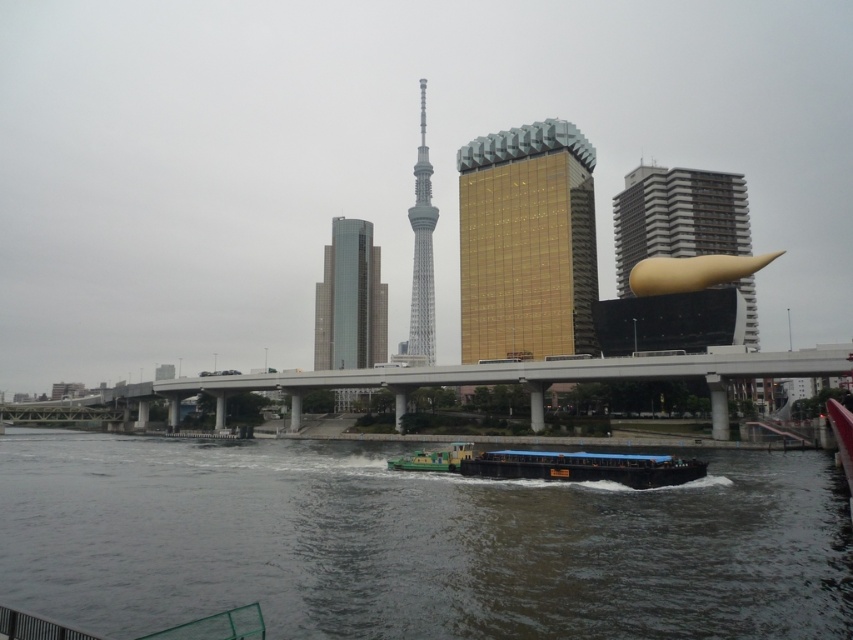
Is point (531, 481) farther from camera compared to point (556, 188)?

That is False.

Can you confirm if dark gray water at center is bigger than gold glass building at center?

No, dark gray water at center is not bigger than gold glass building at center.

Locate an element on the screen. The width and height of the screenshot is (853, 640). dark gray water at center is located at coordinates (415, 545).

I want to click on dark gray water at center, so click(x=415, y=545).

Is glassy gray skyscraper at center to the right of dark blue wooden barge at center from the viewer's perspective?

No, glassy gray skyscraper at center is not to the right of dark blue wooden barge at center.

From the picture: Is glassy gray skyscraper at center thinner than dark blue wooden barge at center?

No.

This screenshot has width=853, height=640. What do you see at coordinates (350, 300) in the screenshot?
I see `glassy gray skyscraper at center` at bounding box center [350, 300].

Image resolution: width=853 pixels, height=640 pixels. Identify the location of glassy gray skyscraper at center. (350, 300).

From the picture: Can you confirm if gold glass building at center is taller than green matte barge at center?

Yes, gold glass building at center is taller than green matte barge at center.

Does gold glass building at center appear on the right side of green matte barge at center?

Yes, gold glass building at center is to the right of green matte barge at center.

Between point (556, 221) and point (410, 456), which one is positioned behind?

Positioned behind is point (556, 221).

Image resolution: width=853 pixels, height=640 pixels. What are the coordinates of `gold glass building at center` in the screenshot? It's located at (526, 243).